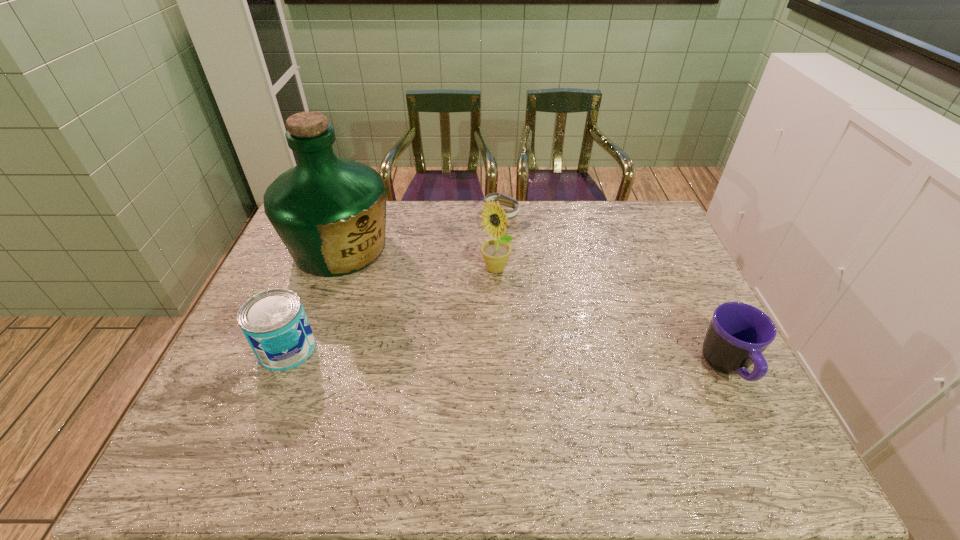
Find the location of a particular element. The height and width of the screenshot is (540, 960). can is located at coordinates (274, 322).

You are a GUI agent. You are given a task and a screenshot of the screen. Output one action in this format:
    pyautogui.click(x=<x>, y=<y>)
    Task: Click on the mug
    This screenshot has width=960, height=540.
    Given the screenshot: What is the action you would take?
    pyautogui.click(x=738, y=334)

The height and width of the screenshot is (540, 960). In order to click on the second tallest object in this screenshot , I will do `click(496, 253)`.

Find the location of a particular element. the shortest object is located at coordinates (505, 200).

I want to click on liquor, so click(x=330, y=213).

The image size is (960, 540). I want to click on vacant region located on the left of the can, so click(x=233, y=349).

Identify the location of vacant region located 0.050m with the handle on the side of the rightmost object. This screenshot has width=960, height=540. (754, 421).

The width and height of the screenshot is (960, 540). In order to click on vacant space located 0.330m on the face of the second tallest object in this screenshot , I will do pyautogui.click(x=464, y=368).

Where is `vacant region located 0.100m on the face of the second tallest object`? vacant region located 0.100m on the face of the second tallest object is located at coordinates (484, 303).

Image resolution: width=960 pixels, height=540 pixels. Find the location of `blank area located on the face of the second tallest object`. blank area located on the face of the second tallest object is located at coordinates (481, 314).